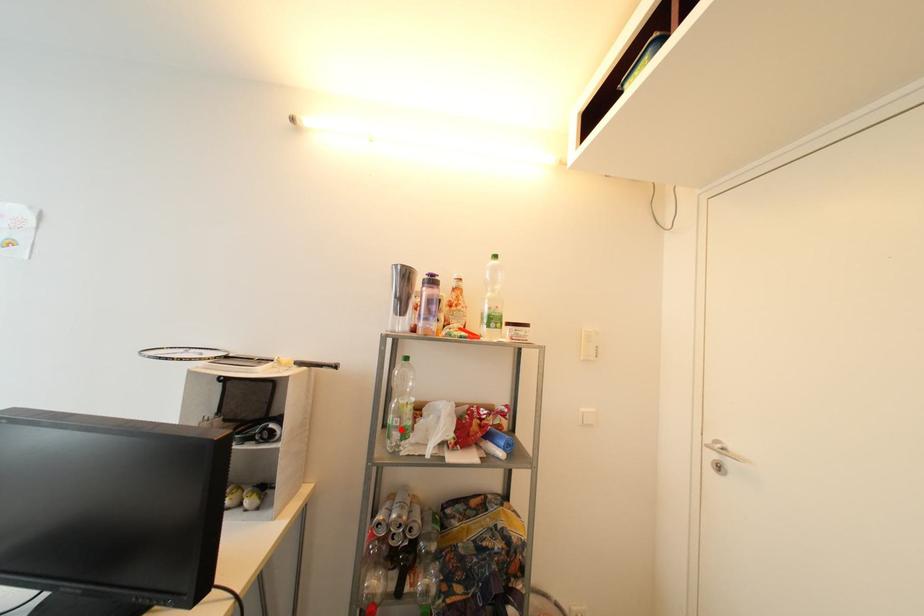
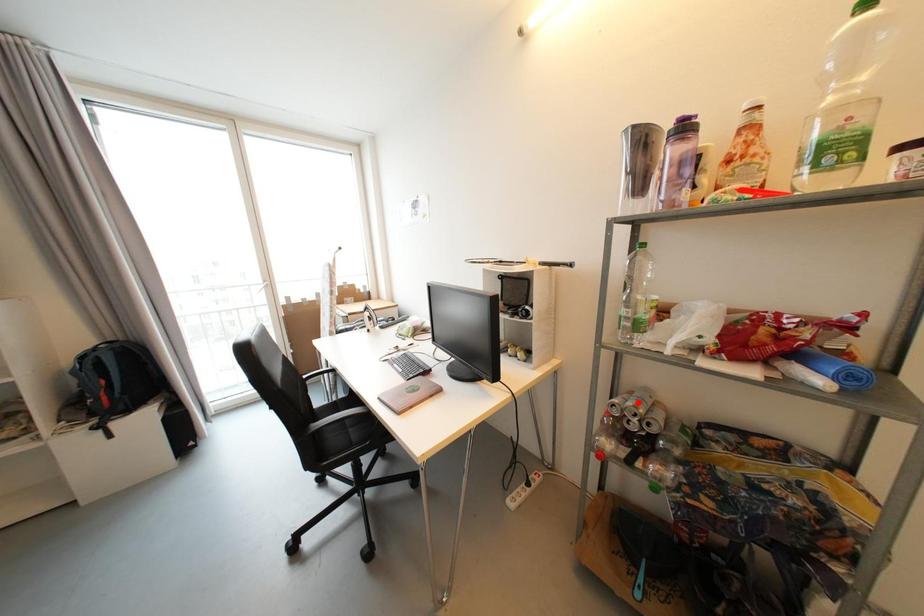
I am providing you with two images of the same scene from different viewpoints. A red point is marked on the first image and another point is marked on the second image. Does the point marked in image1 correspond to the same location as the one in image2?

No